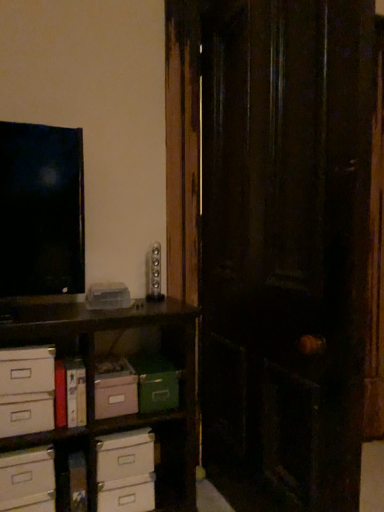
Image resolution: width=384 pixels, height=512 pixels. I want to click on free space above pastel pink cardboard storage box at center-left, the first storage box viewed from the left (from a real-world perspective), so click(106, 362).